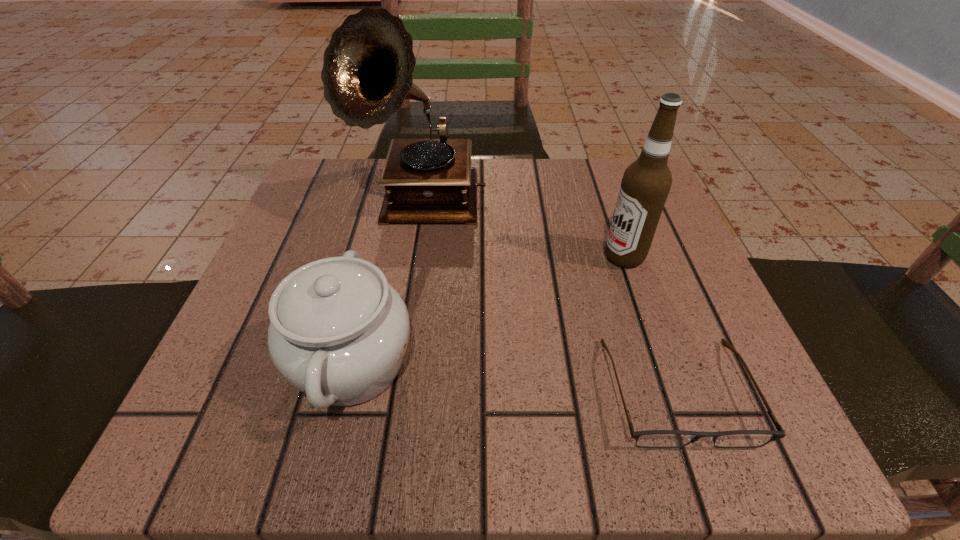
Identify the location of blank region between the third shortest object and the chinaware. (488, 310).

Where is `free area in between the chinaware and the shortest object`? This screenshot has width=960, height=540. free area in between the chinaware and the shortest object is located at coordinates (515, 377).

The width and height of the screenshot is (960, 540). Find the location of `free area in between the second farthest object and the farthest object`. free area in between the second farthest object and the farthest object is located at coordinates (x=522, y=230).

Locate an element on the screen. Image resolution: width=960 pixels, height=540 pixels. unoccupied position between the record player and the alcohol is located at coordinates (522, 230).

Image resolution: width=960 pixels, height=540 pixels. I want to click on free space that is in between the chinaware and the spectacles, so click(515, 377).

The height and width of the screenshot is (540, 960). In order to click on free point between the farthest object and the second tallest object in this screenshot , I will do `click(522, 230)`.

In order to click on unoccupied position between the second farthest object and the tallest object in this screenshot , I will do `click(522, 230)`.

Identify which object is the third nearest to the tallest object. Please provide its 2D coordinates. Your answer should be formatted as a tuple, i.e. [(x, y)], where the tuple contains the x and y coordinates of a point satisfying the conditions above.

[(651, 438)]

Locate an element on the screen. the second closest object to the third tallest object is located at coordinates (651, 438).